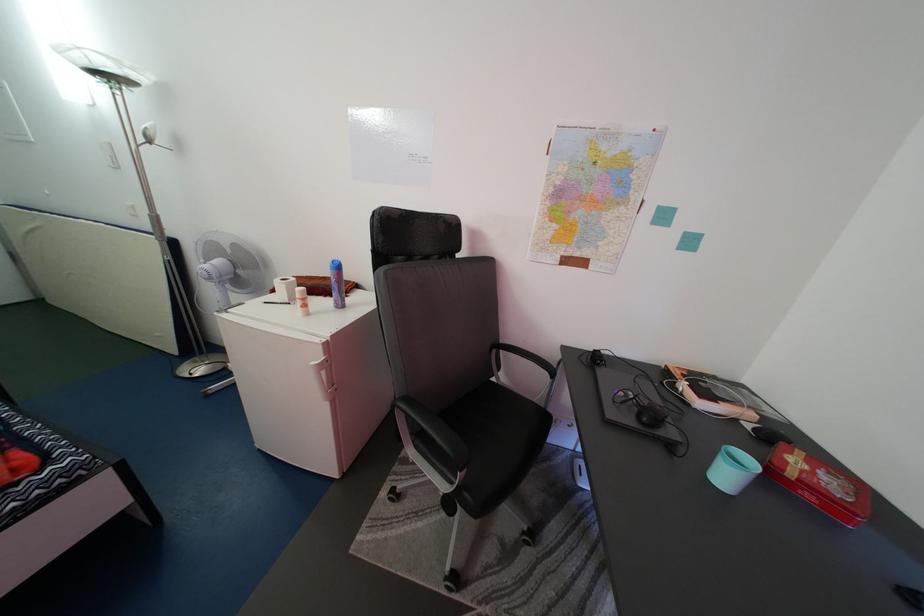
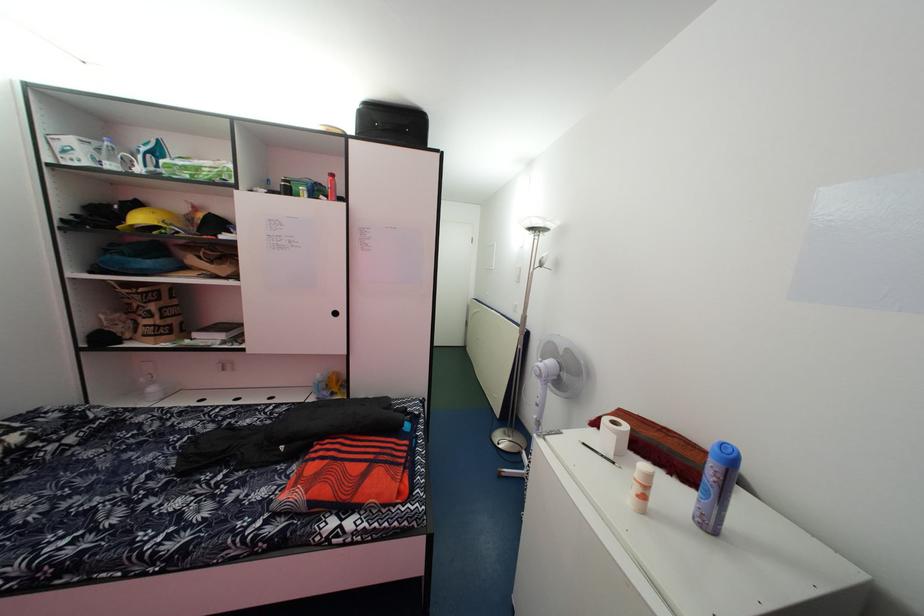
Locate, in the second image, the point that corresponds to pixel 280 304 in the first image.

(600, 442)